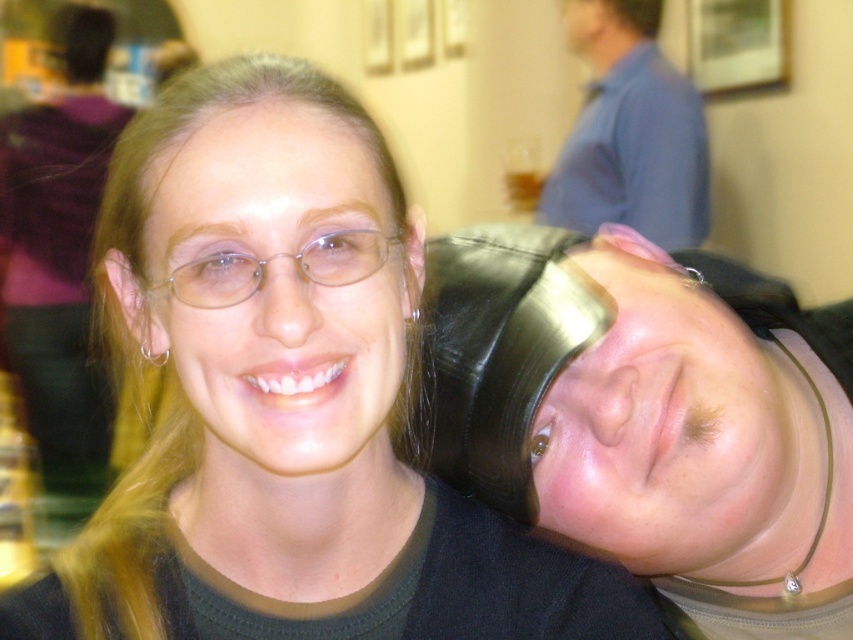
Question: Does matte black hair at center appear over black leather hat at right?

Choices:
 (A) no
 (B) yes

Answer: (A)

Question: Where is matte black hair at center located in relation to blue shirt at upper center in the image?

Choices:
 (A) right
 (B) left

Answer: (B)

Question: Which object is closer to the camera taking this photo?

Choices:
 (A) blue shirt at upper center
 (B) matte black hair at center
 (C) black leather hat at right

Answer: (B)

Question: Which point appears farthest from the camera in this image?

Choices:
 (A) (189, 276)
 (B) (680, 125)
 (C) (395, 477)
 (D) (646, 467)

Answer: (B)

Question: Does black leather hat at right appear on the right side of blue shirt at upper center?

Choices:
 (A) no
 (B) yes

Answer: (A)

Question: Which is farther from the black leather hat at right?

Choices:
 (A) blue shirt at upper center
 (B) matte black hair at center

Answer: (A)